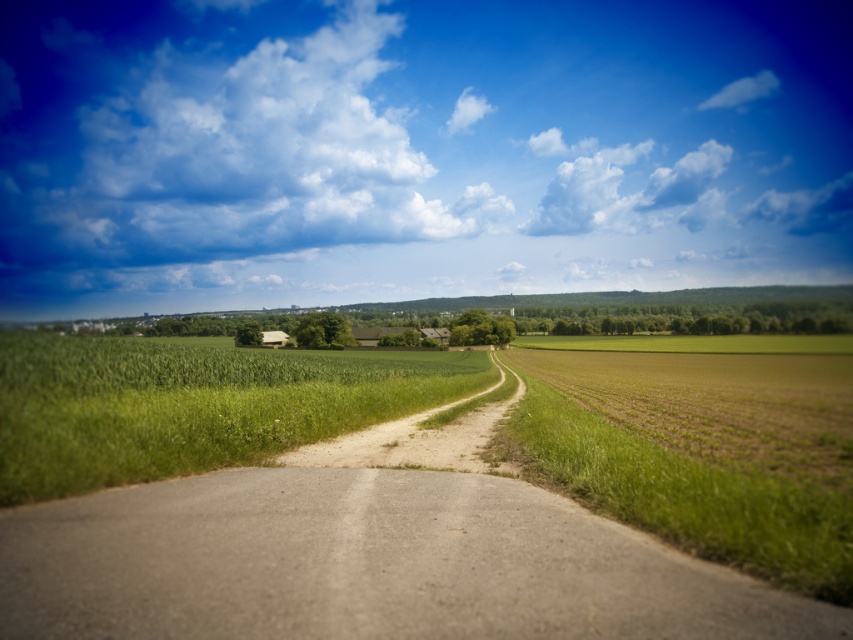
You are a farmer planning to drive your tractor along the brown dirt track at center and the green grassy field at center. Which path is higher in elevation?

The brown dirt track at center is located above the green grassy field at center, so the brown dirt track at center has a higher elevation.